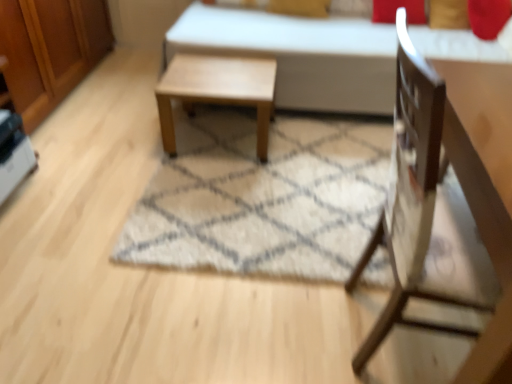
Question: From a real-world perspective, is wooden chair at right over wooden dresser at left?

Choices:
 (A) no
 (B) yes

Answer: (B)

Question: Considering the relative sizes of wooden chair at right and wooden dresser at left in the image provided, is wooden chair at right thinner than wooden dresser at left?

Choices:
 (A) yes
 (B) no

Answer: (B)

Question: Is wooden chair at right bigger than wooden dresser at left?

Choices:
 (A) yes
 (B) no

Answer: (B)

Question: Is wooden chair at right further to camera compared to wooden dresser at left?

Choices:
 (A) yes
 (B) no

Answer: (B)

Question: Considering the relative sizes of wooden chair at right and wooden dresser at left in the image provided, is wooden chair at right taller than wooden dresser at left?

Choices:
 (A) no
 (B) yes

Answer: (B)

Question: Is wooden chair at right outside of wooden dresser at left?

Choices:
 (A) yes
 (B) no

Answer: (A)

Question: Is white fabric bed at center in front of white shaggy rug at center?

Choices:
 (A) yes
 (B) no

Answer: (B)

Question: Can you confirm if white fabric bed at center is positioned to the right of white shaggy rug at center?

Choices:
 (A) no
 (B) yes

Answer: (B)

Question: From a real-world perspective, is white fabric bed at center below white shaggy rug at center?

Choices:
 (A) no
 (B) yes

Answer: (A)

Question: Is the depth of white fabric bed at center greater than that of white shaggy rug at center?

Choices:
 (A) no
 (B) yes

Answer: (B)

Question: Does white fabric bed at center have a lesser height compared to white shaggy rug at center?

Choices:
 (A) no
 (B) yes

Answer: (A)

Question: Is white fabric bed at center positioned beyond the bounds of white shaggy rug at center?

Choices:
 (A) no
 (B) yes

Answer: (B)

Question: Does wooden dresser at left have a greater width compared to white shaggy rug at center?

Choices:
 (A) no
 (B) yes

Answer: (A)